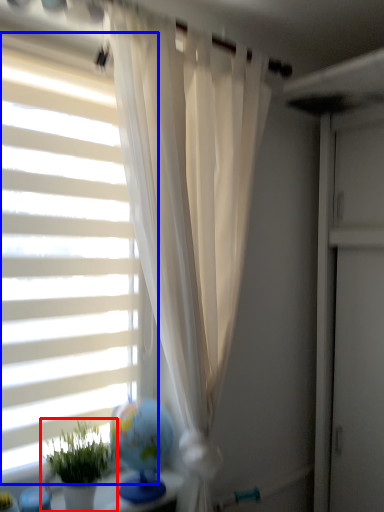
Question: Which object appears farthest to the camera in this image, houseplant (highlighted by a red box) or window blind (highlighted by a blue box)?

Choices:
 (A) houseplant
 (B) window blind

Answer: (B)